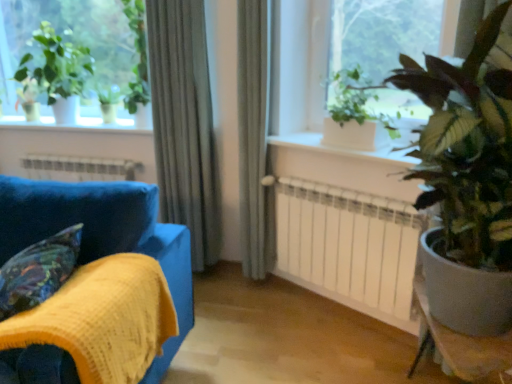
At what (x,y) coordinates should I click in order to perform the action: click on free location to the left of satin fabric curtain at center, positioned as the first curtain in right-to-left order. Please return your answer as a coordinate pair (x, y). The width and height of the screenshot is (512, 384). Looking at the image, I should click on (214, 287).